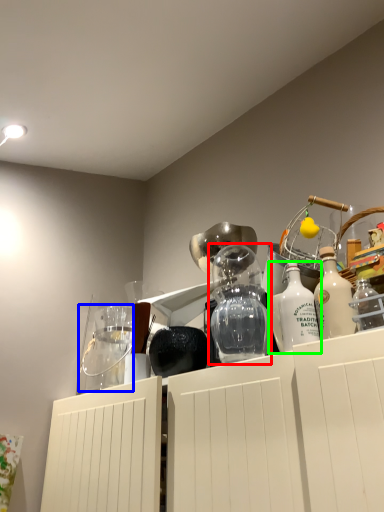
Question: Which is nearer to the glass vase (highlighted by a red box)? glass jar (highlighted by a blue box) or bottle (highlighted by a green box).

Choices:
 (A) glass jar
 (B) bottle

Answer: (B)